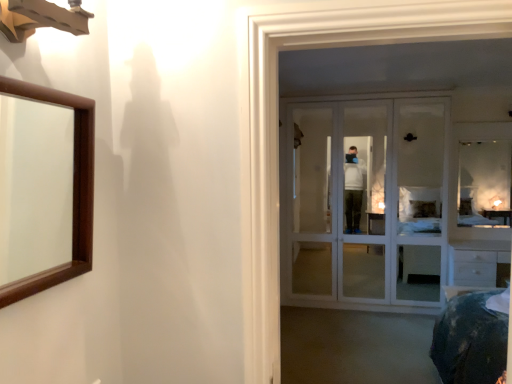
Question: Can you confirm if clear glass mirror at upper right, which appears as the first mirror when viewed from the back, is shorter than white glass door at center?

Choices:
 (A) no
 (B) yes

Answer: (B)

Question: Are clear glass mirror at upper right, the 2th mirror from the front, and white glass door at center located far from each other?

Choices:
 (A) yes
 (B) no

Answer: (B)

Question: Can you confirm if clear glass mirror at upper right, acting as the second mirror starting from the left, is positioned to the left of white glass door at center?

Choices:
 (A) no
 (B) yes

Answer: (A)

Question: Does clear glass mirror at upper right, the 2th mirror from the front, come in front of white glass door at center?

Choices:
 (A) no
 (B) yes

Answer: (A)

Question: Does clear glass mirror at upper right, the 1th mirror when ordered from right to left, turn towards white glass door at center?

Choices:
 (A) no
 (B) yes

Answer: (A)

Question: Is clear glass mirror at upper right, the 1th mirror when ordered from right to left, wider or thinner than white glass door at center?

Choices:
 (A) thin
 (B) wide

Answer: (A)

Question: Considering the relative positions of clear glass mirror at upper right, the 1th mirror when ordered from right to left, and white glass door at center in the image provided, is clear glass mirror at upper right, the 1th mirror when ordered from right to left, to the left or to the right of white glass door at center?

Choices:
 (A) right
 (B) left

Answer: (A)

Question: From a real-world perspective, is clear glass mirror at upper right, the 1th mirror when ordered from right to left, above or below white glass door at center?

Choices:
 (A) above
 (B) below

Answer: (A)

Question: Which is correct: clear glass mirror at upper right, the 1th mirror when ordered from right to left, is inside white glass door at center, or outside of it?

Choices:
 (A) inside
 (B) outside

Answer: (B)

Question: From a real-world perspective, is brown wooden mirror at left, the 2th mirror from the back, positioned above or below white glass door at center?

Choices:
 (A) below
 (B) above

Answer: (B)

Question: Is brown wooden mirror at left, the 2th mirror from the back, wider or thinner than white glass door at center?

Choices:
 (A) wide
 (B) thin

Answer: (B)

Question: From the image's perspective, is brown wooden mirror at left, placed as the second mirror when sorted from right to left, positioned above or below white glass door at center?

Choices:
 (A) below
 (B) above

Answer: (B)

Question: Visually, is brown wooden mirror at left, placed as the second mirror when sorted from right to left, positioned to the left or to the right of white glass door at center?

Choices:
 (A) right
 (B) left

Answer: (B)

Question: Considering the positions of clear glass mirror at upper right, which appears as the first mirror when viewed from the back, and brown wooden mirror at left, placed as the second mirror when sorted from right to left, in the image, is clear glass mirror at upper right, which appears as the first mirror when viewed from the back, taller or shorter than brown wooden mirror at left, placed as the second mirror when sorted from right to left,?

Choices:
 (A) tall
 (B) short

Answer: (A)

Question: Is point (472, 160) closer or farther from the camera than point (2, 246)?

Choices:
 (A) closer
 (B) farther

Answer: (B)